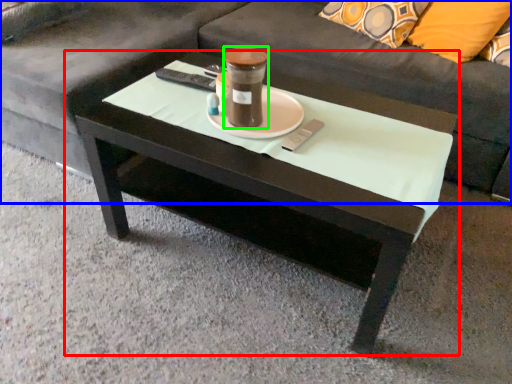
Question: Considering the real-world distances, which object is closest to coffee table (highlighted by a red box)? studio couch (highlighted by a blue box) or beverage (highlighted by a green box).

Choices:
 (A) studio couch
 (B) beverage

Answer: (B)